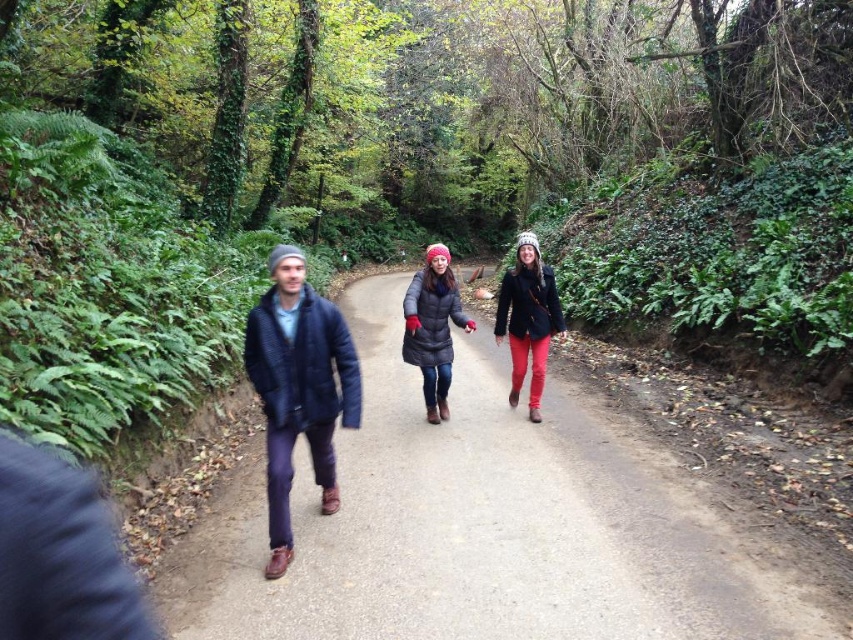
Question: Based on their relative distances, which object is nearer to the matte black jacket at center?

Choices:
 (A) matte black coat at center
 (B) dark blue quilted jacket at center

Answer: (A)

Question: Estimate the real-world distances between objects in this image. Which object is closer to the dark blue quilted jacket at center?

Choices:
 (A) smooth concrete path at center
 (B) matte black jacket at center

Answer: (A)

Question: Does dark blue quilted jacket at center have a smaller size compared to matte black coat at center?

Choices:
 (A) yes
 (B) no

Answer: (A)

Question: Among these objects, which one is farthest from the camera?

Choices:
 (A) matte black coat at center
 (B) smooth concrete path at center

Answer: (A)

Question: In this image, where is dark blue quilted jacket at center located relative to matte black jacket at center?

Choices:
 (A) left
 (B) right

Answer: (A)

Question: Can you confirm if matte black jacket at center is positioned to the left of matte black coat at center?

Choices:
 (A) yes
 (B) no

Answer: (B)